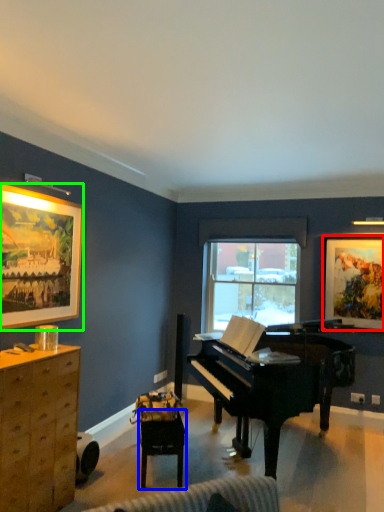
Question: Which is nearer to the picture frame (highlighted by a red box)? table (highlighted by a blue box) or picture frame (highlighted by a green box).

Choices:
 (A) table
 (B) picture frame

Answer: (A)